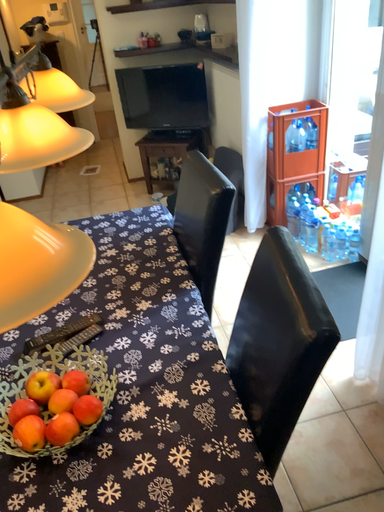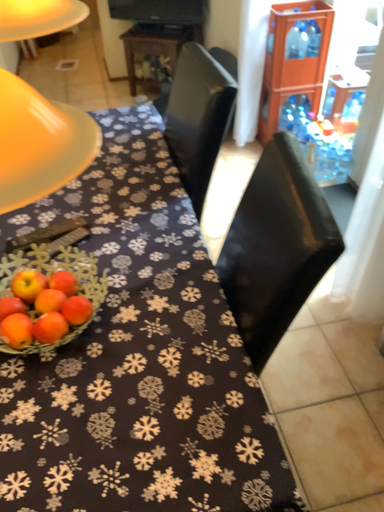
Question: How did the camera likely rotate when shooting the video?

Choices:
 (A) rotated upward
 (B) rotated downward

Answer: (B)